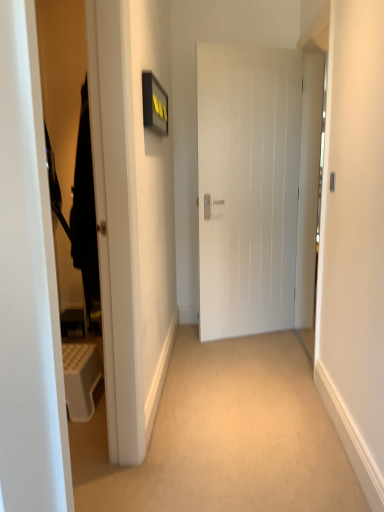
From the picture: In order to face black fabric robe at left, should I rotate leftwards or rightwards?

Turn left approximately 14.118 degrees to face it.

Locate an element on the screen. black fabric robe at left is located at coordinates (85, 216).

Is there a large distance between satin silver door handle at center and black fabric robe at left?

Absolutely, satin silver door handle at center is distant from black fabric robe at left.

Considering the relative positions of satin silver door handle at center and black fabric robe at left in the image provided, is satin silver door handle at center to the right of black fabric robe at left from the viewer's perspective?

Correct, you'll find satin silver door handle at center to the right of black fabric robe at left.

Is black fabric robe at left at the back of satin silver door handle at center?

No, satin silver door handle at center is not facing away from black fabric robe at left.

Consider the image. Is satin silver door handle at center completely or partially outside of black fabric robe at left?

Yes, satin silver door handle at center is not within black fabric robe at left.

Does satin silver door handle at center have a smaller size compared to white matte door at center?

Yes.

Does satin silver door handle at center appear on the left side of white matte door at center?

No, satin silver door handle at center is not to the left of white matte door at center.

Between satin silver door handle at center and white matte door at center, which one has more height?

white matte door at center.

I want to click on door handle on the right of white matte door at center, so click(x=332, y=181).

Find the location of a particular element. The image size is (384, 512). robe in front of the white matte door at center is located at coordinates (85, 216).

Between white matte door at center and black fabric robe at left, which one appears on the left side from the viewer's perspective?

Positioned to the left is black fabric robe at left.

From the picture: How distant is white matte door at center from black fabric robe at left?

The distance of white matte door at center from black fabric robe at left is 1.22 meters.

Does white matte door at center have a lesser width compared to black fabric robe at left?

Yes, white matte door at center is thinner than black fabric robe at left.

Find the location of a particular element. This screenshot has height=512, width=384. door handle on the right of white matte door at center is located at coordinates (332, 181).

From a real-world perspective, is white matte door at center beneath satin silver door handle at center?

Yes, from a real-world perspective, white matte door at center is beneath satin silver door handle at center.

Is white matte door at center far from satin silver door handle at center?

Yes, white matte door at center and satin silver door handle at center are quite far apart.

From the image's perspective, would you say black fabric robe at left is positioned over white matte door at center?

No, from the image's perspective, black fabric robe at left is not above white matte door at center.

In terms of height, does black fabric robe at left look taller or shorter compared to white matte door at center?

Considering their sizes, black fabric robe at left has less height than white matte door at center.

Measure the distance between black fabric robe at left and white matte door at center.

The distance of black fabric robe at left from white matte door at center is 1.22 meters.

Looking at their sizes, would you say black fabric robe at left is wider or thinner than white matte door at center?

black fabric robe at left is wider than white matte door at center.

From the image's perspective, is black fabric robe at left above satin silver door handle at center?

No, from the image's perspective, black fabric robe at left is not above satin silver door handle at center.

Does black fabric robe at left appear on the left side of satin silver door handle at center?

Indeed, black fabric robe at left is positioned on the left side of satin silver door handle at center.

Which object is wider, black fabric robe at left or satin silver door handle at center?

black fabric robe at left is wider.

Identify the location of robe in front of the satin silver door handle at center. (85, 216).

At what (x,y) coordinates should I click in order to perform the action: click on door handle on the right of black fabric robe at left. Please return your answer as a coordinate pair (x, y). Looking at the image, I should click on (332, 181).

You are a GUI agent. You are given a task and a screenshot of the screen. Output one action in this format:
    pyautogui.click(x=<x>, y=<y>)
    Task: Click on the door handle in front of the white matte door at center
    This screenshot has width=384, height=512.
    Given the screenshot: What is the action you would take?
    pyautogui.click(x=332, y=181)

From the image, which object appears to be nearer to black fabric robe at left, white matte door at center or satin silver door handle at center?

satin silver door handle at center lies closer to black fabric robe at left than the other object.

When comparing their distances from satin silver door handle at center, does white matte door at center or black fabric robe at left seem further?

Among the two, white matte door at center is located further to satin silver door handle at center.

Considering their positions, is satin silver door handle at center positioned further to white matte door at center than black fabric robe at left?

black fabric robe at left is positioned further to the anchor white matte door at center.

Looking at the image, which one is located closer to white matte door at center, black fabric robe at left or satin silver door handle at center?

satin silver door handle at center.

Based on their spatial positions, is black fabric robe at left or white matte door at center further from satin silver door handle at center?

Among the two, white matte door at center is located further to satin silver door handle at center.

Estimate the real-world distances between objects in this image. Which object is closer to black fabric robe at left, satin silver door handle at center or white matte door at center?

satin silver door handle at center lies closer to black fabric robe at left than the other object.

Find the location of a particular element. door between black fabric robe at left and satin silver door handle at center from left to right is located at coordinates (247, 188).